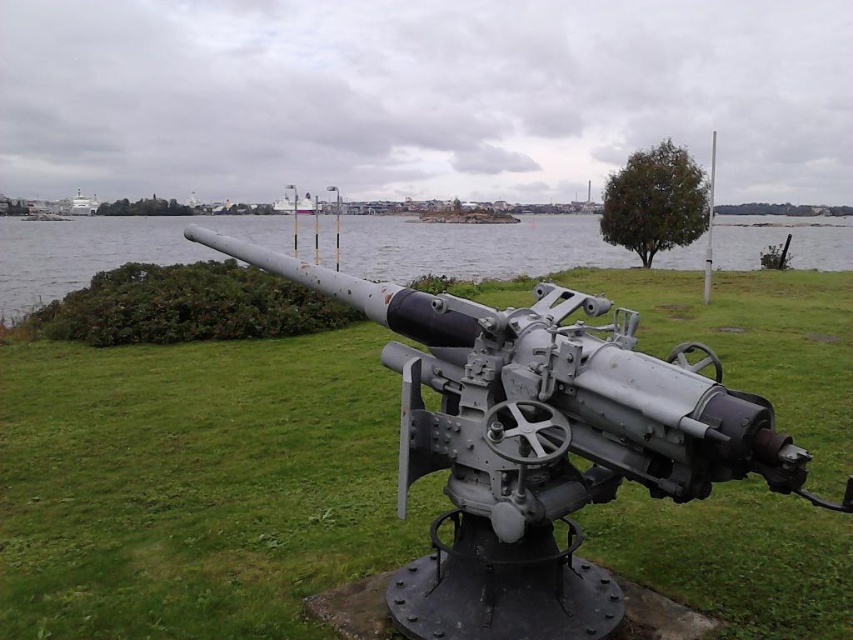
You are a military engineer inspecting the naval gun. You notice two points marked on the gun. The first point is at coordinates point [563,291] and the second is at point [25,243]. Which point is nearer to your current position as you stand in front of the gun?

Point [563,291] is closer to the viewer than point [25,243], so the first point is nearer to your current position.

You are a historian examining the image of a naval gun site. You notice the gray metallic cannon at center and the gray metallic water at center. Based on their positions, which object is located to the right of the other?

The gray metallic cannon at center is positioned on the right side of gray metallic water at center.

You are a military engineer inspecting the coastal defense setup. You notice the gray metallic cannon at center and the gray metallic water at center. Which object takes up more area in the image?

The gray metallic water at center occupies more area than the gray metallic cannon at center.